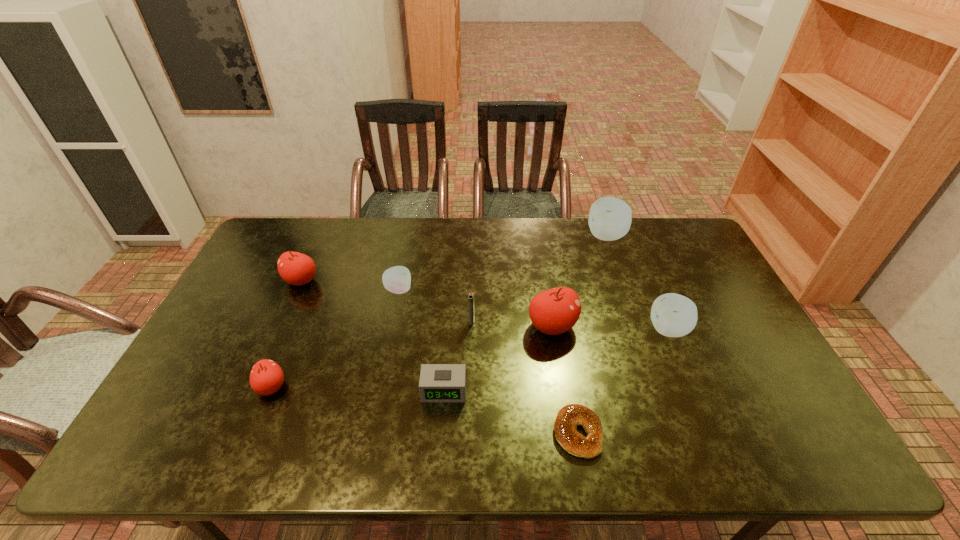
This screenshot has height=540, width=960. I want to click on the smallest red apple, so click(266, 377).

Where is `alarm clock`? Image resolution: width=960 pixels, height=540 pixels. alarm clock is located at coordinates (439, 383).

At what (x,y) coordinates should I click in order to perform the action: click on the second shortest object. Please return your answer as a coordinate pair (x, y). Looking at the image, I should click on (439, 383).

Find the location of a particular element. tan bagel is located at coordinates (570, 416).

Find the location of a particular element. The width and height of the screenshot is (960, 540). the shortest object is located at coordinates (570, 416).

You are a GUI agent. You are given a task and a screenshot of the screen. Output one action in this format:
    pyautogui.click(x=<x>, y=<y>)
    Task: Click on the blank space located on the front of the farthest apple
    
    Given the screenshot: What is the action you would take?
    click(624, 285)

Where is `free space located on the front of the rightmost red apple`? free space located on the front of the rightmost red apple is located at coordinates (564, 394).

At what (x,y) coordinates should I click in order to perform the action: click on vacant space positioned 0.270m on the back of the second smallest white apple. Please return your answer as a coordinate pair (x, y). Looking at the image, I should click on (638, 258).

Locate an element on the screen. The height and width of the screenshot is (540, 960). vacant space situated on the front of the second biggest red apple is located at coordinates pyautogui.click(x=273, y=344).

Where is `free space located 0.240m on the right of the igniter`? free space located 0.240m on the right of the igniter is located at coordinates (556, 321).